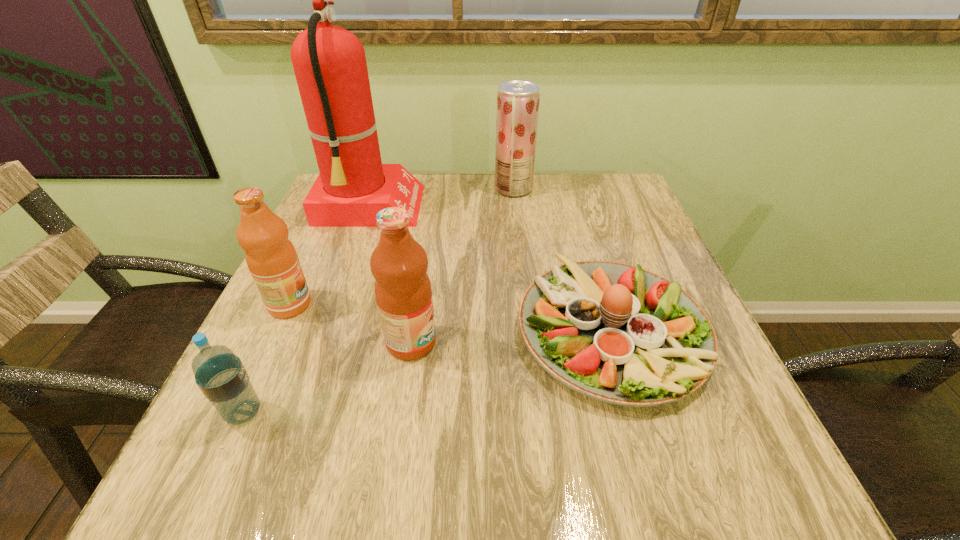
Locate an element on the screen. The image size is (960, 540). vacant space located on the back of the fifth tallest object is located at coordinates (271, 353).

Locate an element on the screen. Image resolution: width=960 pixels, height=540 pixels. free location located 0.070m on the left of the salad plate is located at coordinates (481, 330).

Where is `fire extinguisher positioned at the far edge`? fire extinguisher positioned at the far edge is located at coordinates (329, 62).

This screenshot has height=540, width=960. Identify the location of fruit juice present at the far edge. (518, 101).

You are a GUI agent. You are given a task and a screenshot of the screen. Output one action in this format:
    pyautogui.click(x=<x>, y=<y>)
    Task: Click on the fire extinguisher that is at the left edge
    The height and width of the screenshot is (540, 960).
    Given the screenshot: What is the action you would take?
    pyautogui.click(x=329, y=62)

At what (x,y) coordinates should I click in order to perform the action: click on fruit juice present at the left edge. Please return your answer as a coordinate pair (x, y). The width and height of the screenshot is (960, 540). Looking at the image, I should click on (272, 260).

Find the location of a particular element. water bottle present at the left edge is located at coordinates (221, 376).

I want to click on object located in the right edge section of the desktop, so click(620, 334).

This screenshot has height=540, width=960. Find the location of `object that is positioned at the far left corner`. object that is positioned at the far left corner is located at coordinates (329, 62).

This screenshot has width=960, height=540. What are the coordinates of `free space at the far edge` in the screenshot? It's located at (466, 216).